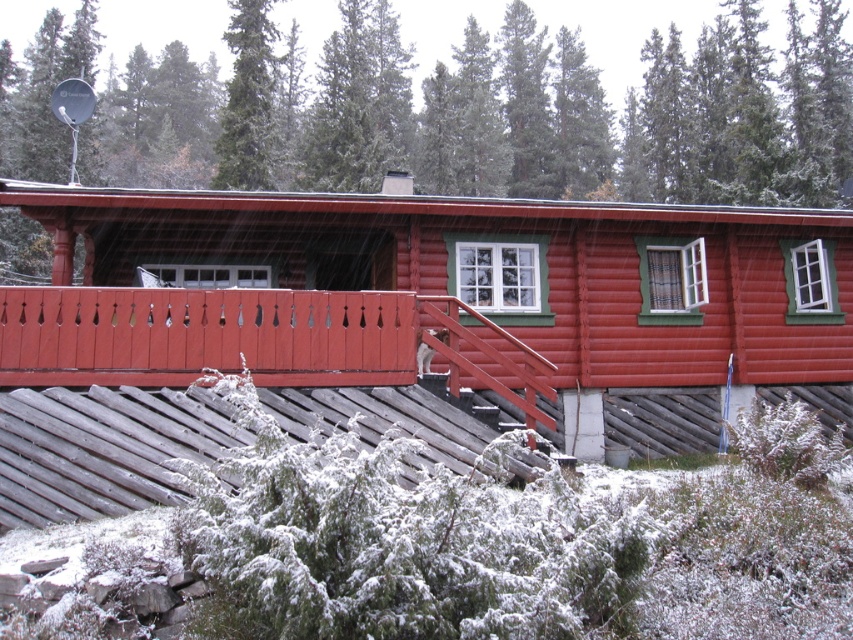
Question: Which object appears closest to the camera in this image?

Choices:
 (A) matte wooden cabin at center
 (B) green coniferous tree at upper center

Answer: (A)

Question: Is matte wooden cabin at center to the right of green coniferous tree at upper center from the viewer's perspective?

Choices:
 (A) yes
 (B) no

Answer: (B)

Question: Does matte wooden cabin at center appear under green coniferous tree at upper center?

Choices:
 (A) no
 (B) yes

Answer: (B)

Question: Which point is closer to the camera?

Choices:
 (A) green coniferous tree at upper center
 (B) matte wooden cabin at center

Answer: (B)

Question: Can you confirm if matte wooden cabin at center is smaller than green coniferous tree at upper center?

Choices:
 (A) yes
 (B) no

Answer: (A)